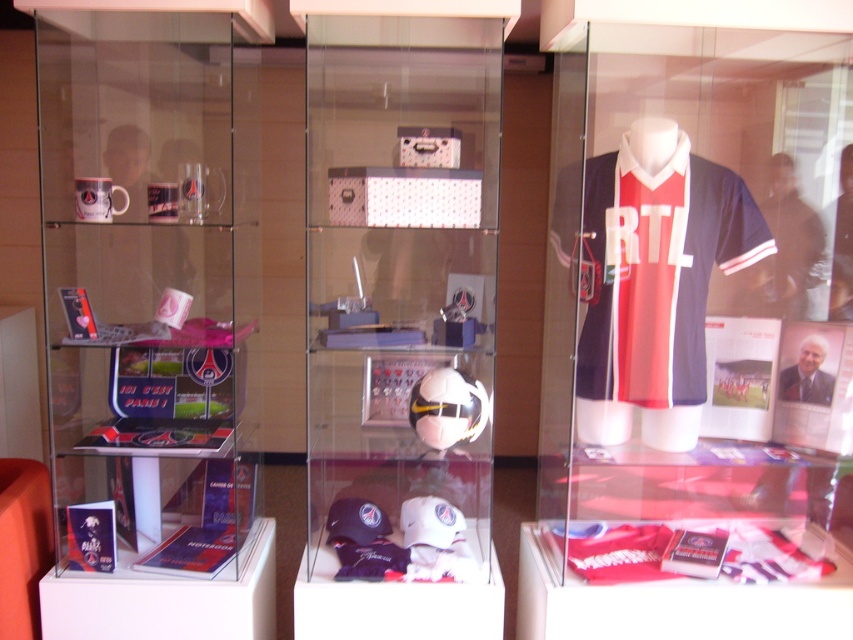
Question: Where is matte jersey at center located in relation to white glossy soccer ball at center in the image?

Choices:
 (A) below
 (B) above

Answer: (A)

Question: Can you confirm if matte jersey at center is thinner than white glossy soccer ball at center?

Choices:
 (A) no
 (B) yes

Answer: (A)

Question: Among these points, which one is farthest from the camera?

Choices:
 (A) (679, 316)
 (B) (467, 528)

Answer: (B)

Question: Can you confirm if matte jersey at center is thinner than white glossy soccer ball at center?

Choices:
 (A) no
 (B) yes

Answer: (A)

Question: Which object appears farthest from the camera in this image?

Choices:
 (A) white glossy soccer ball at center
 (B) matte jersey at center

Answer: (A)